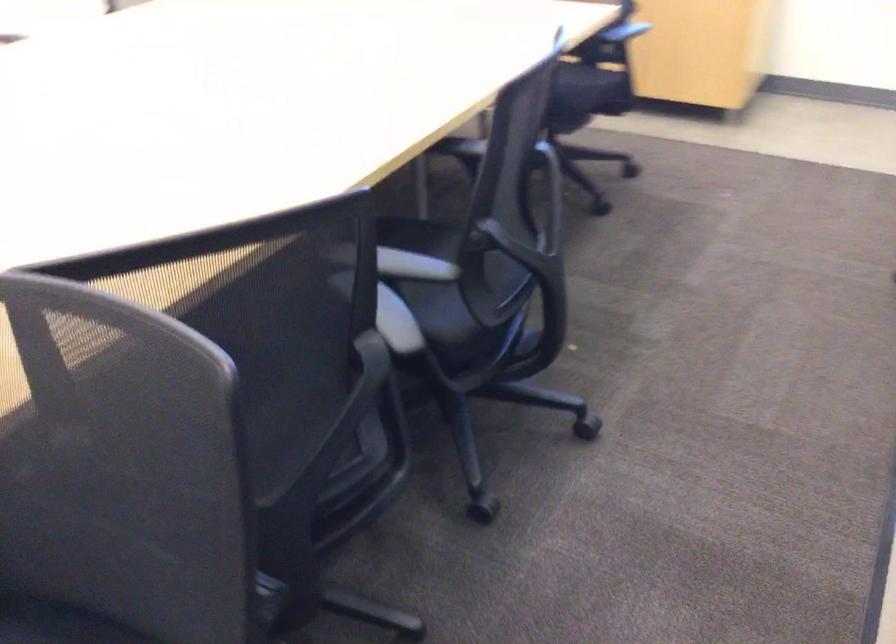
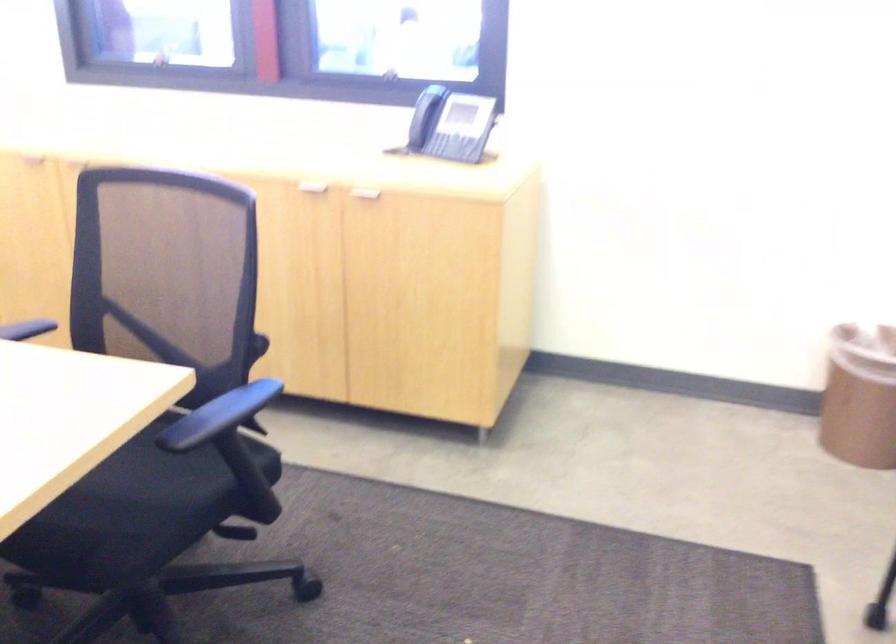
In the second image, find the point that corresponds to the point at 562,84 in the first image.

(124, 498)